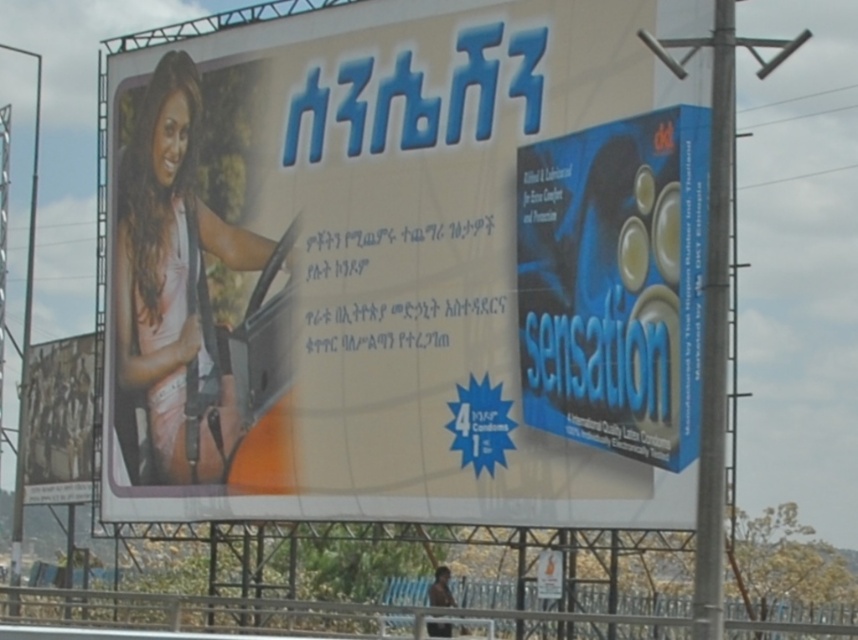
Question: Which is farther from the matte white billboard at center?

Choices:
 (A) blue cardboard sensation at right
 (B) matte pink shirt at left

Answer: (A)

Question: Among these points, which one is nearest to the camera?

Choices:
 (A) (618, 188)
 (B) (68, 486)
 (C) (233, 442)

Answer: (A)

Question: Can you confirm if matte white billboard at center is thinner than matte pink shirt at left?

Choices:
 (A) yes
 (B) no

Answer: (B)

Question: Which point is closer to the camera?

Choices:
 (A) matte pink shirt at left
 (B) matte white billboard at center
 (C) blue cardboard sensation at right
 (D) rustic wood sign at lower left

Answer: (B)

Question: Is blue cardboard sensation at right bigger than rustic wood sign at lower left?

Choices:
 (A) yes
 (B) no

Answer: (B)

Question: Can you confirm if matte white billboard at center is bigger than matte pink shirt at left?

Choices:
 (A) yes
 (B) no

Answer: (A)